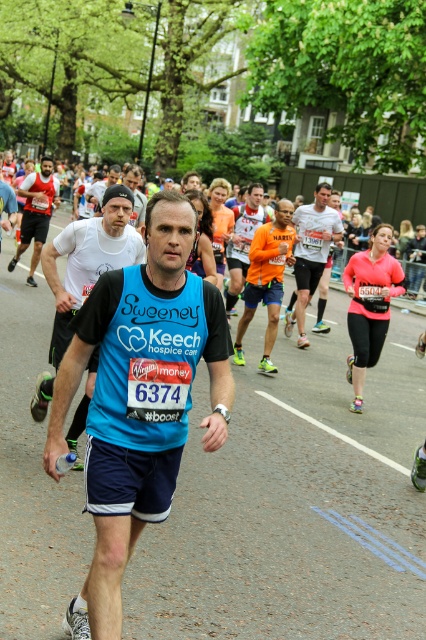
You are a GUI agent. You are given a task and a screenshot of the screen. Output one action in this format:
    pyautogui.click(x=<x>, y=<y>)
    Task: Click on the white matte shirt at center
    Image resolution: width=426 pixels, height=640 pixels.
    Given the screenshot: What is the action you would take?
    pyautogui.click(x=311, y=252)

Can you confirm if white matte shirt at center is bigger than matte red tank top at left?

Correct, white matte shirt at center is larger in size than matte red tank top at left.

Image resolution: width=426 pixels, height=640 pixels. In order to click on white matte shirt at center in this screenshot , I will do `click(311, 252)`.

Can you confirm if orange reflective vest at center is bigger than matte black cap at upper center?

Yes, orange reflective vest at center is bigger than matte black cap at upper center.

Where is `orange reflective vest at center`? orange reflective vest at center is located at coordinates point(242,241).

Locate an element on the screen. Image resolution: width=426 pixels, height=640 pixels. orange reflective vest at center is located at coordinates (242, 241).

Where is `orange reflective vest at center`? The image size is (426, 640). orange reflective vest at center is located at coordinates (242, 241).

Is pink matte leggings at center above orange reflective vest at center?

Incorrect, pink matte leggings at center is not positioned above orange reflective vest at center.

Between pink matte leggings at center and orange reflective vest at center, which one appears on the left side from the viewer's perspective?

orange reflective vest at center is more to the left.

Identify the location of pink matte leggings at center. (370, 305).